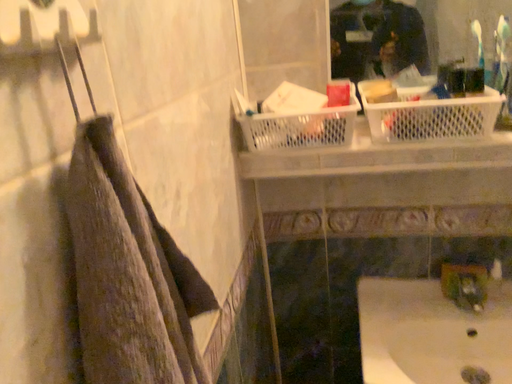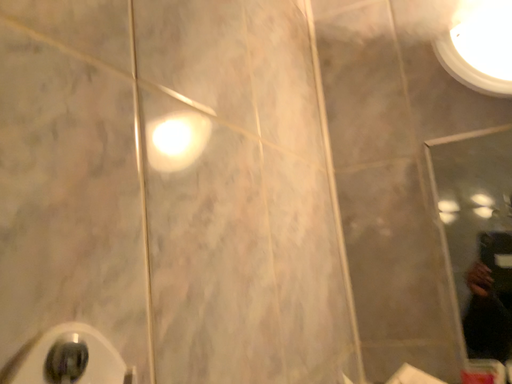
Question: How did the camera likely rotate when shooting the video?

Choices:
 (A) rotated right
 (B) rotated left

Answer: (B)